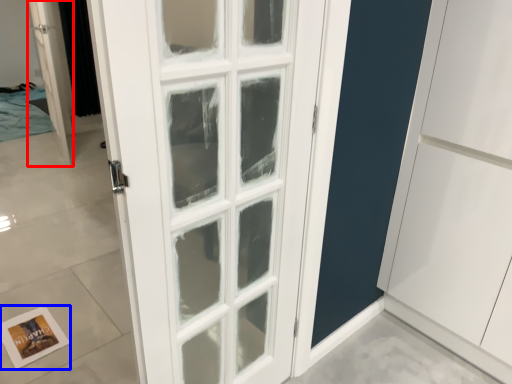
Question: Which object is further to the camera taking this photo, door (highlighted by a red box) or postcard (highlighted by a blue box)?

Choices:
 (A) door
 (B) postcard

Answer: (A)